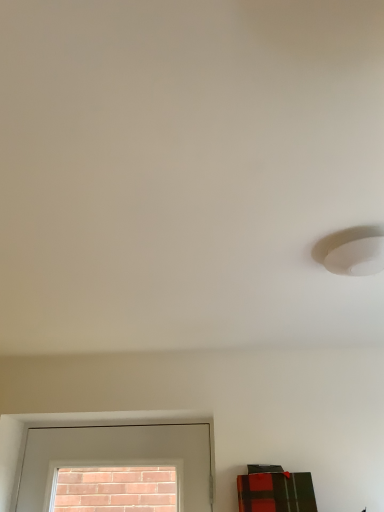
Describe the element at coordinates (276, 492) in the screenshot. This screenshot has height=512, width=384. I see `plaid fabric box at lower right` at that location.

The height and width of the screenshot is (512, 384). Find the location of `plaid fabric box at lower right`. plaid fabric box at lower right is located at coordinates (276, 492).

Identify the location of plaid fabric box at lower right. Image resolution: width=384 pixels, height=512 pixels. (276, 492).